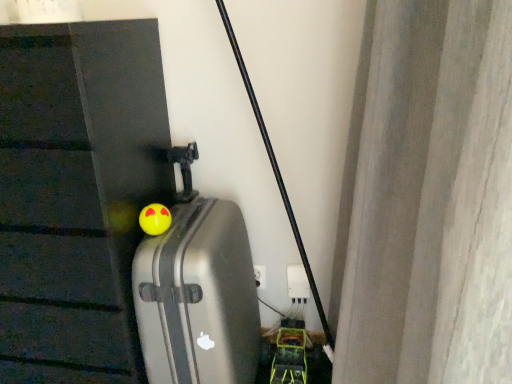
Question: Considering the relative sizes of silver metallic suitcase at center and yellow rubber ball at center in the image provided, is silver metallic suitcase at center smaller than yellow rubber ball at center?

Choices:
 (A) yes
 (B) no

Answer: (B)

Question: Can you confirm if silver metallic suitcase at center is shorter than yellow rubber ball at center?

Choices:
 (A) yes
 (B) no

Answer: (B)

Question: Is silver metallic suitcase at center far from yellow rubber ball at center?

Choices:
 (A) yes
 (B) no

Answer: (B)

Question: Is silver metallic suitcase at center to the right of yellow rubber ball at center from the viewer's perspective?

Choices:
 (A) no
 (B) yes

Answer: (B)

Question: Is silver metallic suitcase at center facing towards yellow rubber ball at center?

Choices:
 (A) yes
 (B) no

Answer: (A)

Question: From the image's perspective, is silver metallic suitcase at center on top of yellow rubber ball at center?

Choices:
 (A) no
 (B) yes

Answer: (A)

Question: Is yellow rubber ball at center in front of silver metallic suitcase at center?

Choices:
 (A) no
 (B) yes

Answer: (A)

Question: From a real-world perspective, is yellow rubber ball at center below silver metallic suitcase at center?

Choices:
 (A) yes
 (B) no

Answer: (B)

Question: Would you say yellow rubber ball at center is a long distance from silver metallic suitcase at center?

Choices:
 (A) yes
 (B) no

Answer: (B)

Question: Is yellow rubber ball at center facing towards silver metallic suitcase at center?

Choices:
 (A) no
 (B) yes

Answer: (B)

Question: Considering the relative sizes of yellow rubber ball at center and silver metallic suitcase at center in the image provided, is yellow rubber ball at center shorter than silver metallic suitcase at center?

Choices:
 (A) no
 (B) yes

Answer: (B)

Question: Does yellow rubber ball at center come behind silver metallic suitcase at center?

Choices:
 (A) no
 (B) yes

Answer: (B)

Question: Relative to yellow rubber ball at center, is silver metallic suitcase at center in front or behind?

Choices:
 (A) front
 (B) behind

Answer: (A)